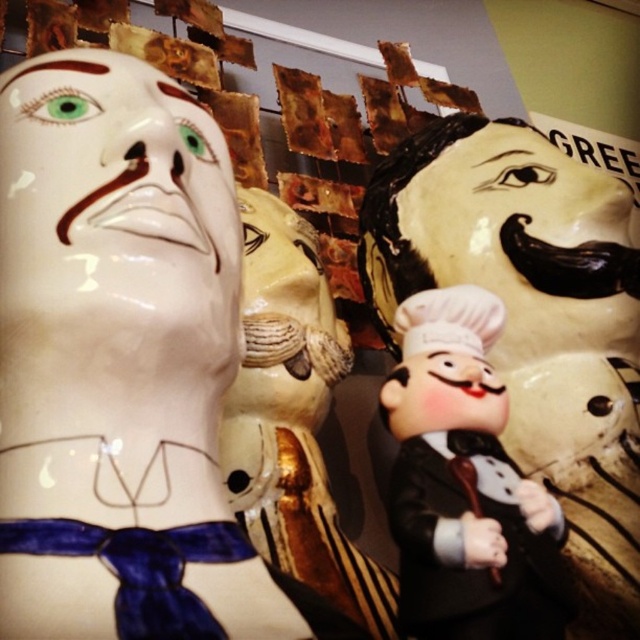
Question: Is matte plastic chef at center closer to camera compared to matte gold mask at center?

Choices:
 (A) no
 (B) yes

Answer: (B)

Question: Which of these objects is positioned closest to the matte black chef figurine at center?

Choices:
 (A) matte gold mask at center
 (B) white glossy mask at upper left
 (C) matte plastic chef at center

Answer: (A)

Question: Among these points, which one is nearest to the camera?

Choices:
 (A) (296, 216)
 (B) (620, 552)

Answer: (B)

Question: Is the position of matte plastic chef at center more distant than that of matte gold mask at center?

Choices:
 (A) yes
 (B) no

Answer: (B)

Question: Which is farther from the matte gold mask at center?

Choices:
 (A) matte plastic chef at center
 (B) matte black chef figurine at center

Answer: (A)

Question: Can you confirm if white glossy mask at upper left is positioned above matte plastic chef at center?

Choices:
 (A) yes
 (B) no

Answer: (A)